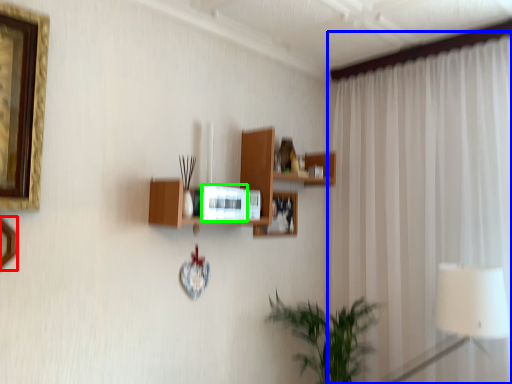
Question: Considering the real-world distances, which object is farthest from picture frame (highlighted by a red box)? curtain (highlighted by a blue box) or picture frame (highlighted by a green box)?

Choices:
 (A) curtain
 (B) picture frame

Answer: (A)